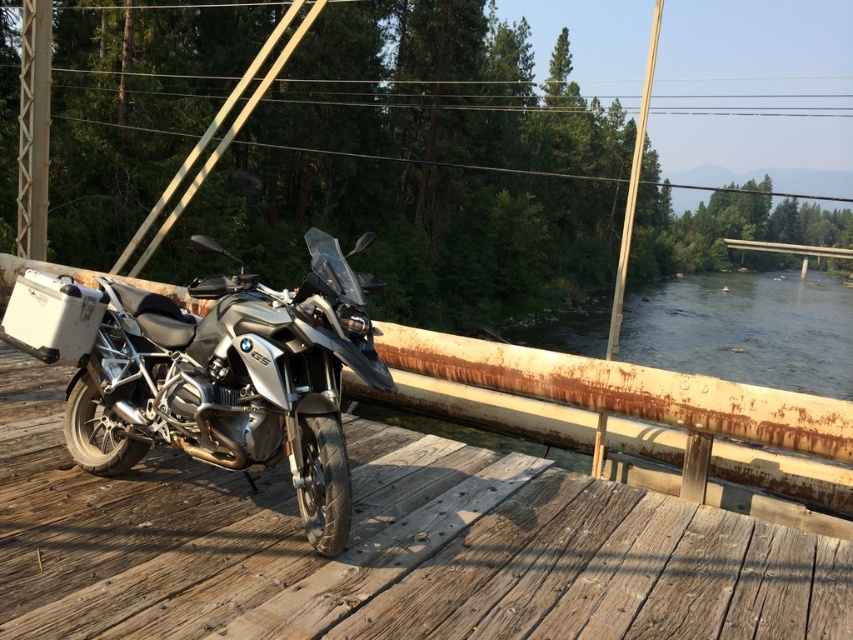
Does silver metallic motorcycle at center appear over brushed metal pole at upper left?

No.

How distant is silver metallic motorcycle at center from brushed metal pole at upper left?

5.96 meters

Between point (131, 408) and point (27, 65), which one is positioned in front?

Point (131, 408) is more forward.

Where is `silver metallic motorcycle at center`? The width and height of the screenshot is (853, 640). silver metallic motorcycle at center is located at coordinates (212, 371).

Between wooden deck at center and silver metallic motorcycle at center, which one appears on the right side from the viewer's perspective?

From the viewer's perspective, wooden deck at center appears more on the right side.

Image resolution: width=853 pixels, height=640 pixels. Identify the location of wooden deck at center. (383, 548).

At what (x,y) coordinates should I click in order to perform the action: click on wooden deck at center. Please return your answer as a coordinate pair (x, y). This screenshot has width=853, height=640. Looking at the image, I should click on (383, 548).

Is wooden deck at center wider than brushed metal pole at upper left?

Yes, wooden deck at center is wider than brushed metal pole at upper left.

Is wooden deck at center to the right of brushed metal pole at upper left from the viewer's perspective?

Correct, you'll find wooden deck at center to the right of brushed metal pole at upper left.

The width and height of the screenshot is (853, 640). In order to click on wooden deck at center in this screenshot , I will do `click(383, 548)`.